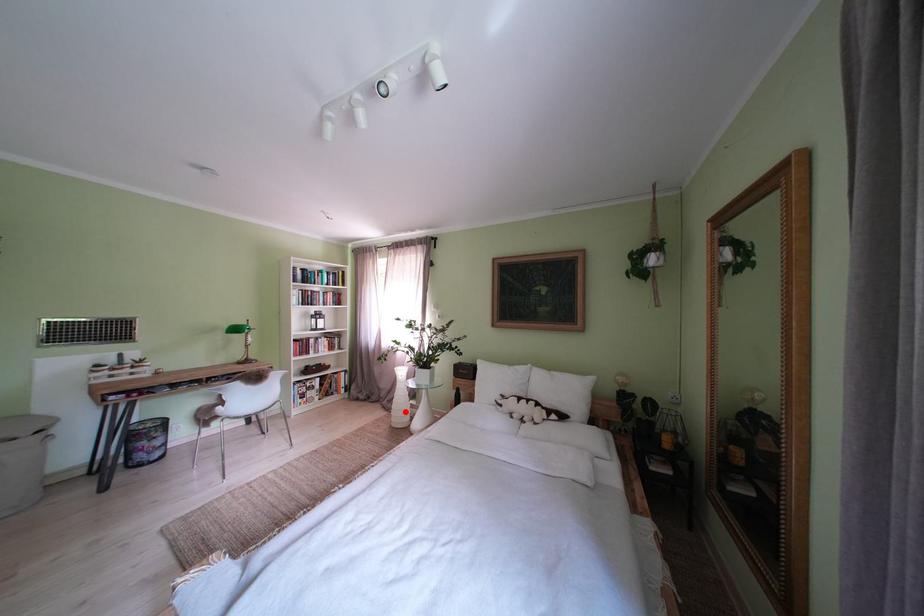
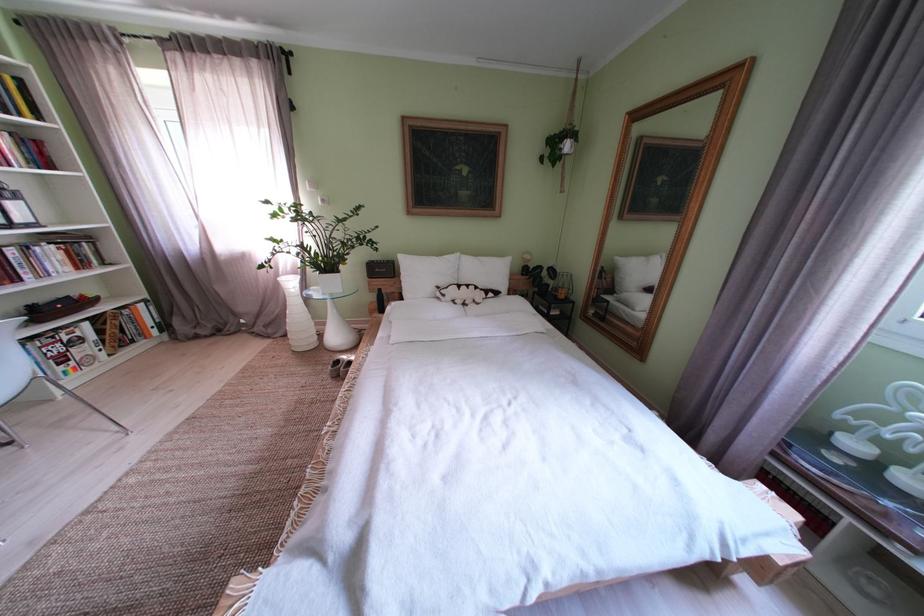
Question: I am providing you with two images of the same scene from different viewpoints. Image1 has a red point marked. In image2, the corresponding 3D location appears at what relative position? Reply with the corresponding letter.

Choices:
 (A) Closer
 (B) Farther

Answer: (A)